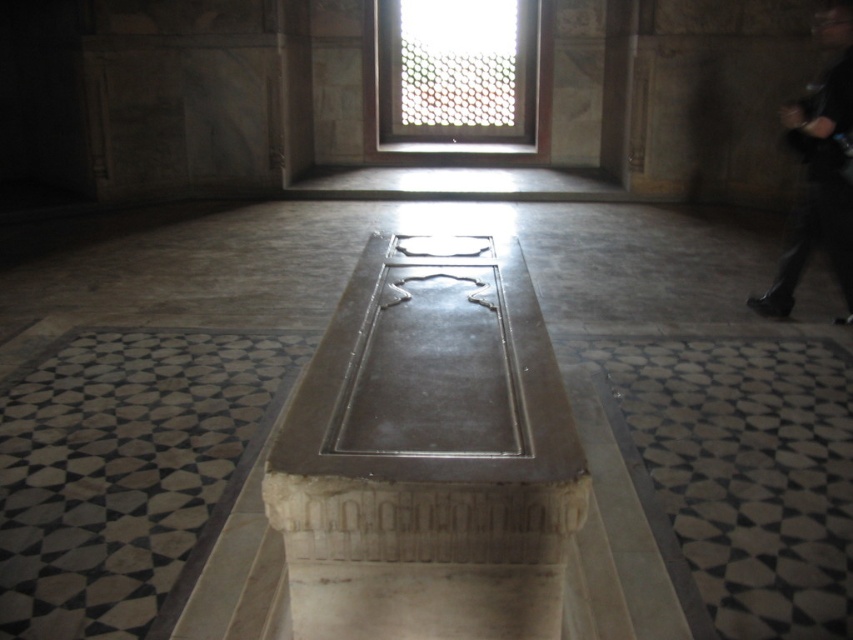
You are standing at the entrance of the historical building and see two points marked in the image. The first point is at coordinates point (465, 584) and the second is at point (791, 248). If you want to walk towards the sarcophagus, which point should you aim for first?

You should aim for point (465, 584) first because it is in front of point (791, 248), meaning it is closer to your current position at the entrance and on the path toward the sarcophagus.

You are an interior designer assessing the space for lighting adjustments. The clear glass lattice at upper center and the black fabric at right are both in your line of sight. Which object would allow more natural light into the room?

The clear glass lattice at upper center allows more natural light into the room because it has a larger size compared to the black fabric at right.